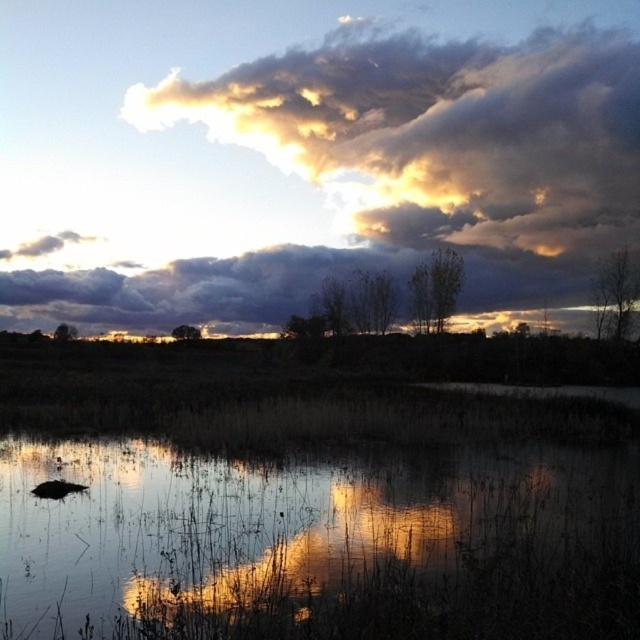
You are an artist trying to paint this scene. You need to decide which area to focus on first based on their sizes. Which object should you paint first, the transparent water at center or the cloudy sky at upper center?

The cloudy sky at upper center should be painted first because it is larger than the transparent water at center.

You are an artist planning to paint the scene. You need to decide the order of painting layers. Which should you paint first, the transparent water at center or the cloudy sky at upper center, based on their positions in the image?

The cloudy sky at upper center should be painted first because the transparent water at center is located below it, meaning the sky appears above the water in the scene.

You are an artist planning to paint this landscape. You want to ensure that the transparent water at center and the cloudy sky at upper center are proportionally accurate. Which object should you paint first if you want to start with the taller one?

The cloudy sky at upper center should be painted first because it is taller than the transparent water at center according to the description.